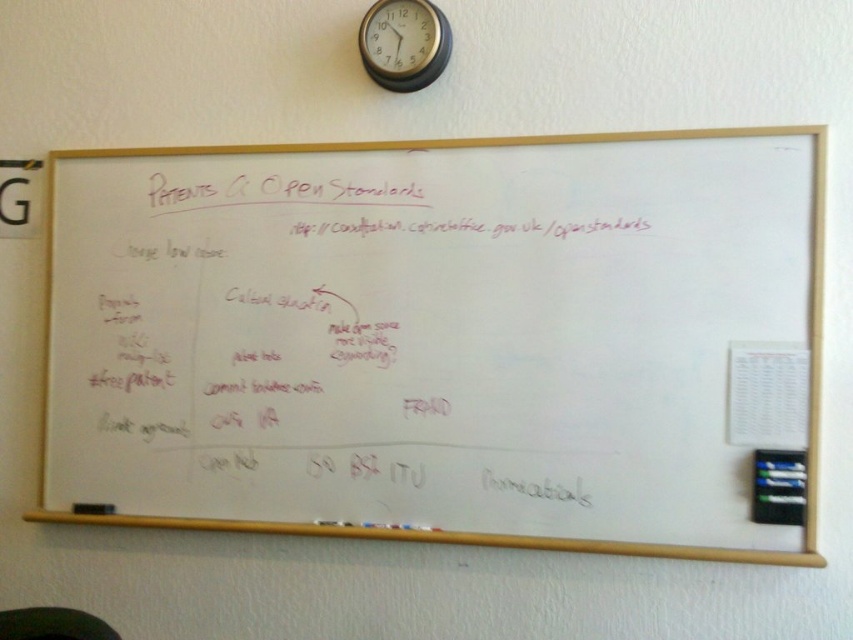
Question: Can you confirm if whiteboard at center is positioned below black plastic clock at upper center?

Choices:
 (A) yes
 (B) no

Answer: (A)

Question: From the image, what is the correct spatial relationship of whiteboard at center in relation to black plastic clock at upper center?

Choices:
 (A) left
 (B) right

Answer: (B)

Question: Which object appears farthest from the camera in this image?

Choices:
 (A) whiteboard at center
 (B) black plastic clock at upper center

Answer: (B)

Question: Considering the relative positions of whiteboard at center and black plastic clock at upper center in the image provided, where is whiteboard at center located with respect to black plastic clock at upper center?

Choices:
 (A) right
 (B) left

Answer: (A)